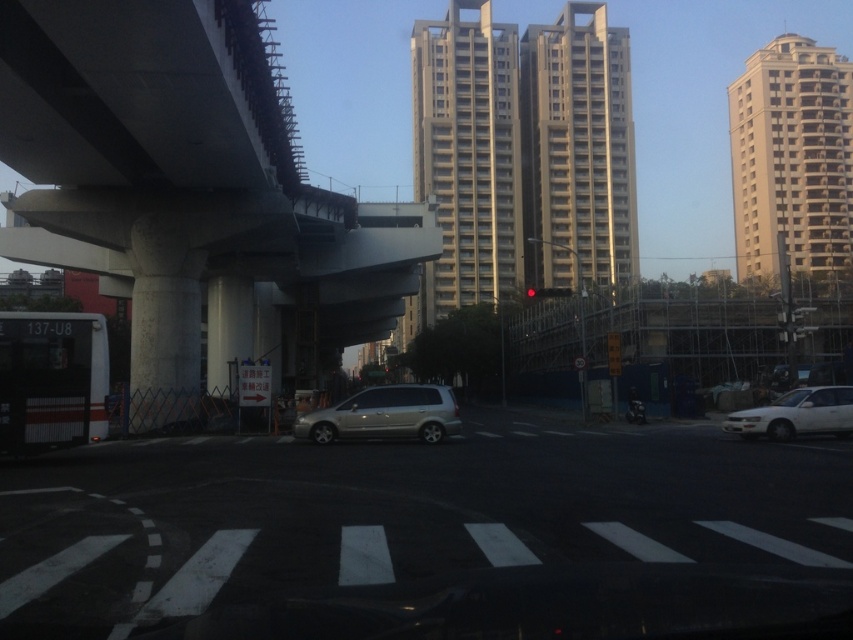
Is concrete at center positioned before red glass traffic light at center?

Yes, it is.

Can you confirm if concrete at center is taller than red glass traffic light at center?

Indeed, concrete at center has a greater height compared to red glass traffic light at center.

Locate an element on the screen. concrete at center is located at coordinates pos(163,323).

At what (x,y) coordinates should I click in order to perform the action: click on concrete at center. Please return your answer as a coordinate pair (x, y). The image size is (853, 640). Looking at the image, I should click on pos(163,323).

Which is below, gray concrete building at center or red glass traffic light at center?

red glass traffic light at center

Looking at this image, can you confirm if gray concrete building at center is thinner than red glass traffic light at center?

Incorrect, gray concrete building at center's width is not less than red glass traffic light at center's.

I want to click on gray concrete building at center, so click(467, 156).

Locate an element on the screen. This screenshot has height=640, width=853. gray concrete building at center is located at coordinates (467, 156).

Who is more forward, (x=804, y=214) or (x=801, y=388)?

Point (x=801, y=388) is in front.

Who is higher up, white concrete building at upper right or white matte sedan at right?

Positioned higher is white concrete building at upper right.

Between point (846, 81) and point (840, 401), which one is positioned behind?

The point (846, 81) is behind.

Find the location of a particular element. This screenshot has height=640, width=853. white concrete building at upper right is located at coordinates (791, 157).